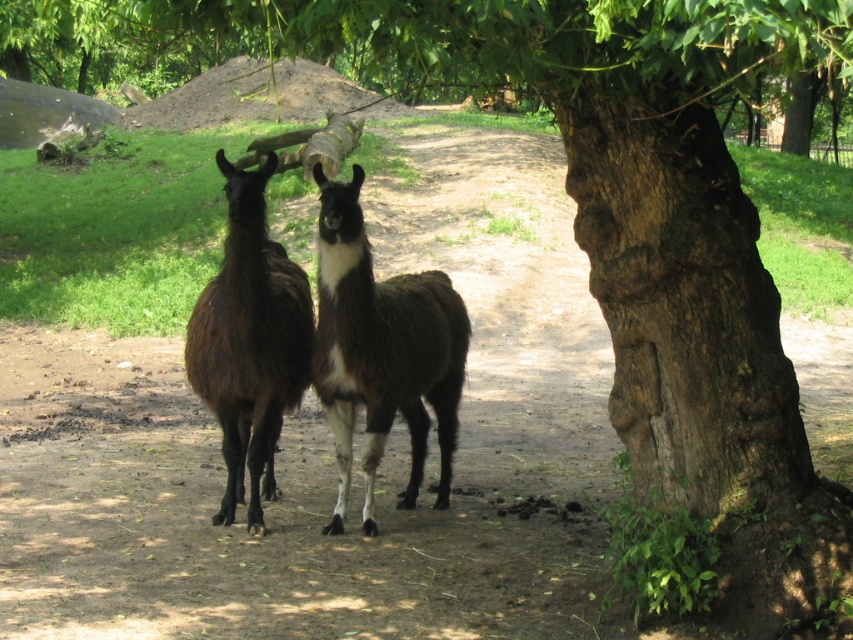
Question: Is brown fuzzy llama at center bigger than brown fuzzy llama at left?

Choices:
 (A) yes
 (B) no

Answer: (A)

Question: Among these points, which one is nearest to the camera?

Choices:
 (A) (279, 388)
 (B) (318, 204)

Answer: (A)

Question: Is brown fuzzy llama at center wider than brown fuzzy llama at left?

Choices:
 (A) no
 (B) yes

Answer: (B)

Question: Is brown fuzzy llama at center in front of brown fuzzy llama at left?

Choices:
 (A) yes
 (B) no

Answer: (A)